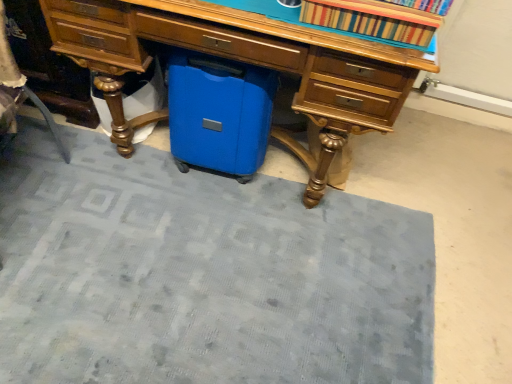
Question: Does matte wood desk at center come in front of blue fabric doormat at lower center?

Choices:
 (A) no
 (B) yes

Answer: (B)

Question: Is matte wood desk at center shorter than blue fabric doormat at lower center?

Choices:
 (A) yes
 (B) no

Answer: (B)

Question: From the image's perspective, is matte wood desk at center over blue fabric doormat at lower center?

Choices:
 (A) yes
 (B) no

Answer: (A)

Question: Does matte wood desk at center have a larger size compared to blue fabric doormat at lower center?

Choices:
 (A) yes
 (B) no

Answer: (A)

Question: Is matte wood desk at center outside of blue fabric doormat at lower center?

Choices:
 (A) no
 (B) yes

Answer: (B)

Question: From a real-world perspective, is blue fabric doormat at lower center positioned above or below striped fabric book at upper center?

Choices:
 (A) below
 (B) above

Answer: (A)

Question: From the image's perspective, is blue fabric doormat at lower center positioned above or below striped fabric book at upper center?

Choices:
 (A) below
 (B) above

Answer: (A)

Question: From their relative heights in the image, would you say blue fabric doormat at lower center is taller or shorter than striped fabric book at upper center?

Choices:
 (A) short
 (B) tall

Answer: (A)

Question: Is blue fabric doormat at lower center to the left or to the right of striped fabric book at upper center in the image?

Choices:
 (A) right
 (B) left

Answer: (B)

Question: From a real-world perspective, is striped fabric book at upper center positioned above or below blue plastic suitcase at center?

Choices:
 (A) below
 (B) above

Answer: (B)

Question: In the image, is striped fabric book at upper center positioned in front of or behind blue plastic suitcase at center?

Choices:
 (A) front
 (B) behind

Answer: (A)

Question: Considering the positions of striped fabric book at upper center and blue plastic suitcase at center in the image, is striped fabric book at upper center taller or shorter than blue plastic suitcase at center?

Choices:
 (A) tall
 (B) short

Answer: (B)

Question: Which is correct: striped fabric book at upper center is inside blue plastic suitcase at center, or outside of it?

Choices:
 (A) inside
 (B) outside

Answer: (B)

Question: In terms of size, does striped fabric book at upper center appear bigger or smaller than matte wood desk at center?

Choices:
 (A) small
 (B) big

Answer: (A)

Question: Considering the positions of point (323, 9) and point (389, 51), is point (323, 9) closer or farther from the camera than point (389, 51)?

Choices:
 (A) closer
 (B) farther

Answer: (A)